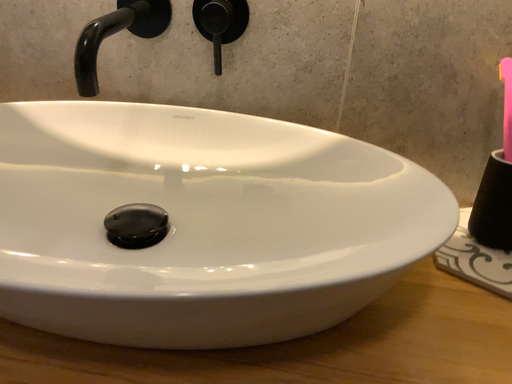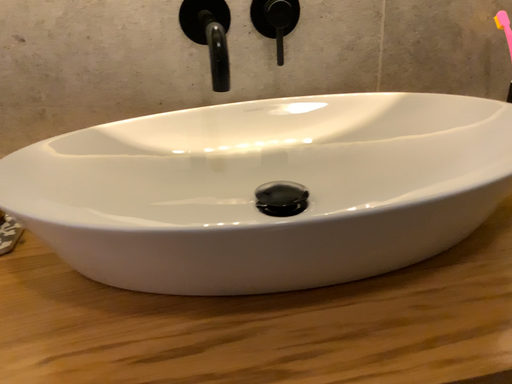
Question: Which way did the camera rotate in the video?

Choices:
 (A) rotated right
 (B) rotated left

Answer: (A)